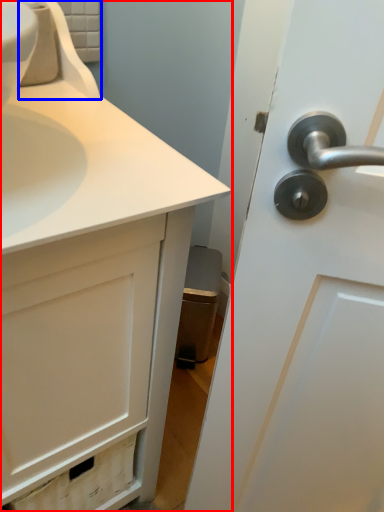
Question: Which of the following is the farthest to the observer, bathroom cabinet (highlighted by a red box) or faucet (highlighted by a blue box)?

Choices:
 (A) bathroom cabinet
 (B) faucet

Answer: (B)